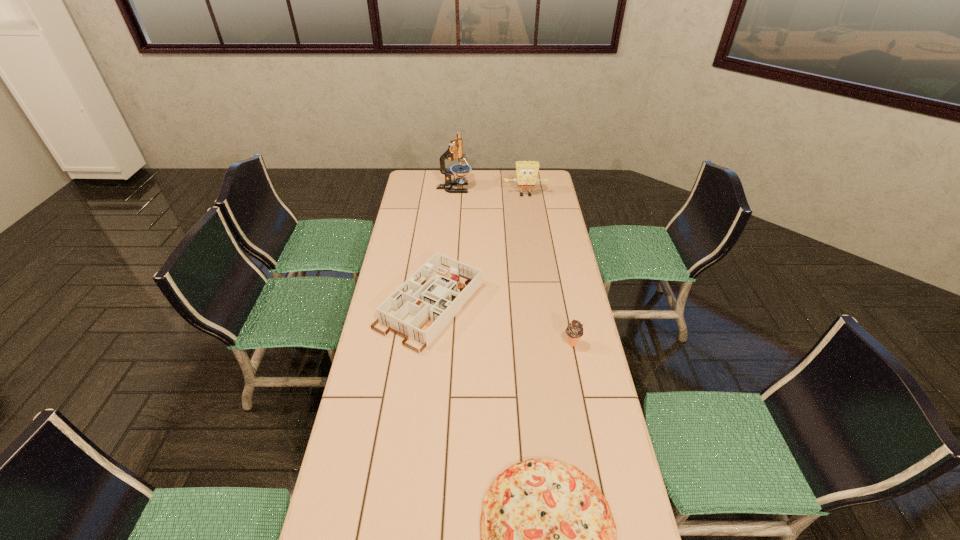
The height and width of the screenshot is (540, 960). In order to click on microscope in this screenshot , I will do coord(455,150).

The width and height of the screenshot is (960, 540). Identify the location of the fourth shortest object. (527, 171).

Locate an element on the screen. The width and height of the screenshot is (960, 540). the third tallest object is located at coordinates (574, 330).

At what (x,y) coordinates should I click in order to perform the action: click on dollhouse. Please return your answer as a coordinate pair (x, y). Looking at the image, I should click on (426, 302).

This screenshot has height=540, width=960. In order to click on vacant space situated at the eyepiece of the microscope in this screenshot , I will do [x=500, y=188].

The height and width of the screenshot is (540, 960). In order to click on vacant space located 0.280m on the face of the second tallest object in this screenshot , I will do `click(531, 231)`.

This screenshot has width=960, height=540. Find the location of `vacant space located 0.290m on the back of the icecream`. vacant space located 0.290m on the back of the icecream is located at coordinates (560, 283).

Where is `vacant position located 0.310m on the back of the dollhouse`? The height and width of the screenshot is (540, 960). vacant position located 0.310m on the back of the dollhouse is located at coordinates (440, 225).

The height and width of the screenshot is (540, 960). What are the coordinates of `microscope positioned at the far edge` in the screenshot? It's located at (455, 150).

In order to click on sponge positioned at the far edge in this screenshot , I will do `click(527, 171)`.